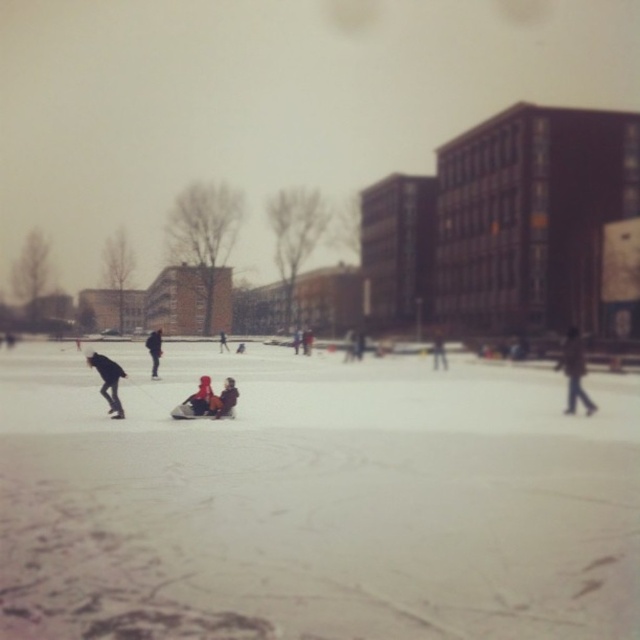
Question: Does dark blue jacket at left appear over dark blue jacket at center?

Choices:
 (A) yes
 (B) no

Answer: (B)

Question: Which point appears farthest from the camera in this image?

Choices:
 (A) (224, 403)
 (B) (122, 378)

Answer: (B)

Question: Which object is closer to the camera taking this photo?

Choices:
 (A) dark gray jacket at center
 (B) dark gray fabric jacket at center
 (C) brown fuzzy coat at right

Answer: (B)

Question: Does white matte snow at center appear over dark gray jacket at center?

Choices:
 (A) no
 (B) yes

Answer: (A)

Question: Which of these objects is positioned farthest from the white matte snow at center?

Choices:
 (A) dark blue fabric jacket at center
 (B) brown fuzzy coat at right
 (C) dark gray fabric jacket at center

Answer: (C)

Question: In this image, where is dark gray fabric jacket at center located relative to dark brown leather jacket at center?

Choices:
 (A) right
 (B) left

Answer: (B)